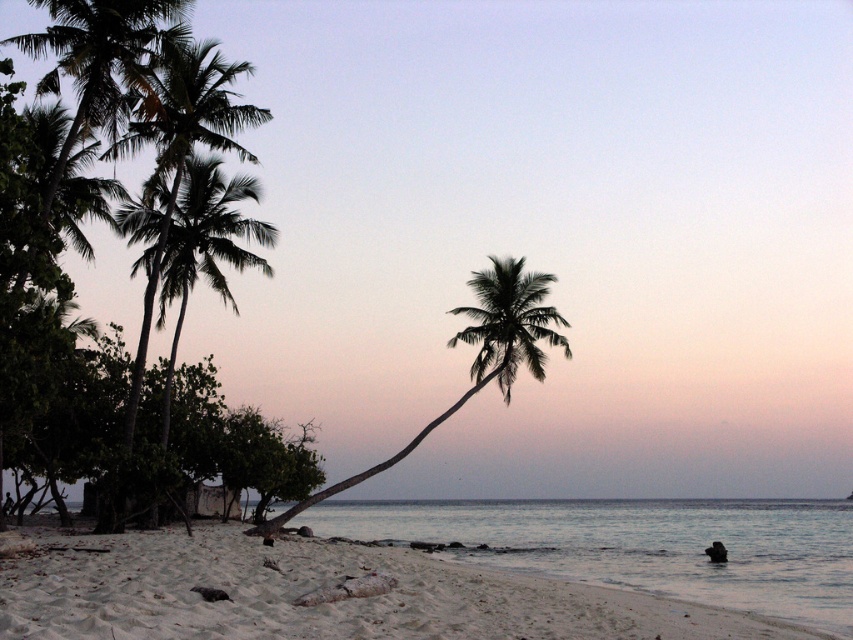
Can you confirm if green leafy palm tree at left is smaller than silhouette leafy palm at center?

No.

Image resolution: width=853 pixels, height=640 pixels. What do you see at coordinates (183, 148) in the screenshot? I see `green leafy palm tree at left` at bounding box center [183, 148].

Does point (170, 157) come closer to viewer compared to point (496, 268)?

Yes, point (170, 157) is closer to viewer.

Identify the location of green leafy palm tree at left. (183, 148).

Does point (289, 630) come in front of point (131, 125)?

Yes, it is in front of point (131, 125).

Does white sandy beach at lower left appear on the left side of green leafy palm tree at left?

No, white sandy beach at lower left is not to the left of green leafy palm tree at left.

Which is behind, point (3, 620) or point (136, 349)?

The point (136, 349) is more distant.

I want to click on white sandy beach at lower left, so click(x=318, y=588).

Based on the photo, does white sandy beach at lower left appear under silhouette leafy palm at center?

Indeed, white sandy beach at lower left is positioned under silhouette leafy palm at center.

Between point (405, 580) and point (503, 298), which one is positioned in front?

Positioned in front is point (405, 580).

Is point (65, 552) behind point (532, 310)?

No, (65, 552) is in front of (532, 310).

Where is `white sandy beach at lower left`? The height and width of the screenshot is (640, 853). white sandy beach at lower left is located at coordinates (318, 588).